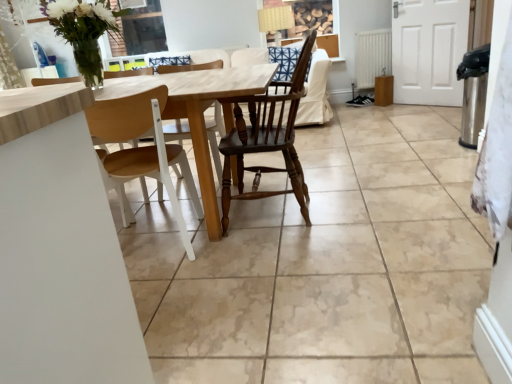
Where is `free location to the right of wooden at left, placed as the 2th chair when sorted from right to left`? The width and height of the screenshot is (512, 384). free location to the right of wooden at left, placed as the 2th chair when sorted from right to left is located at coordinates (234, 252).